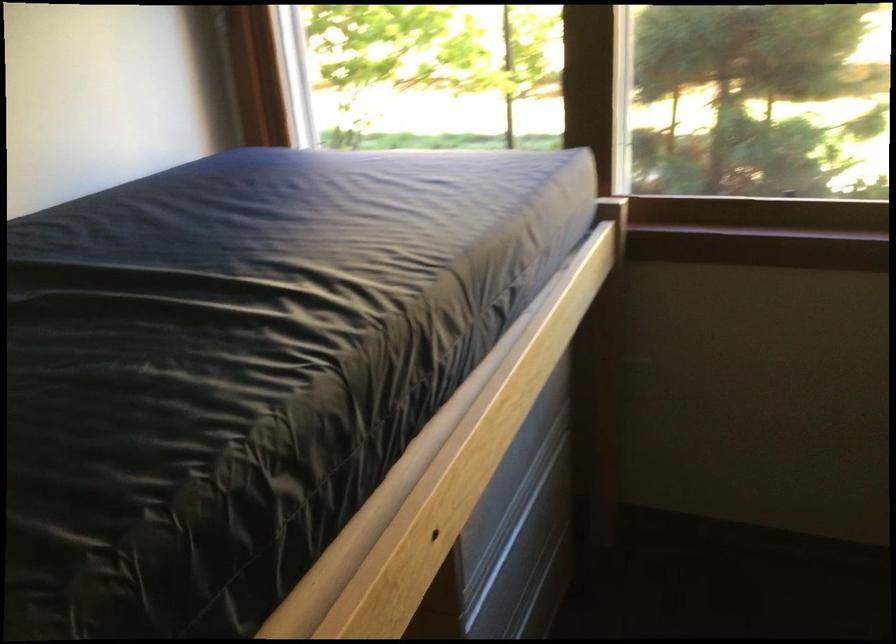
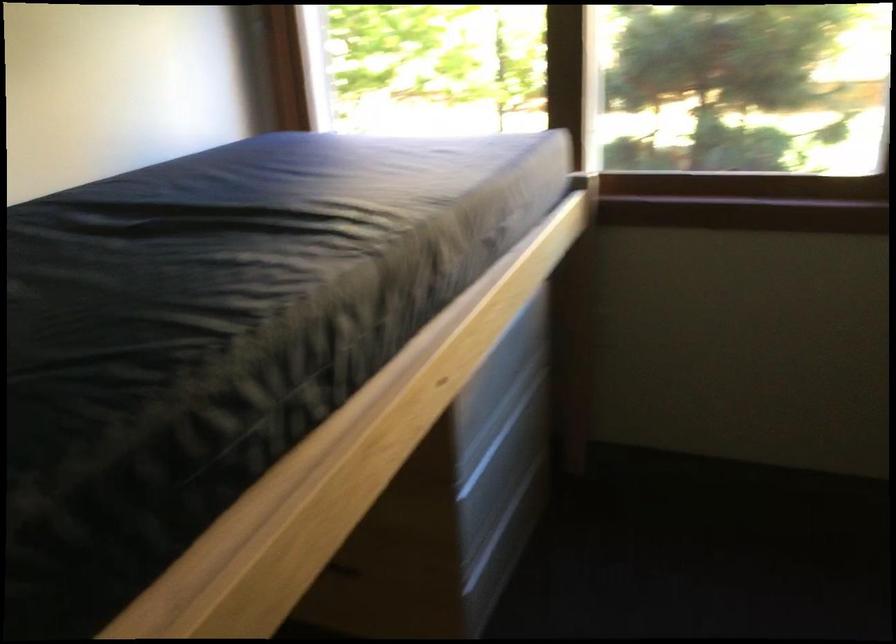
Question: What movement of the cameraman would produce the second image?

Choices:
 (A) Left
 (B) Right
 (C) Forward
 (D) Backward

Answer: (D)